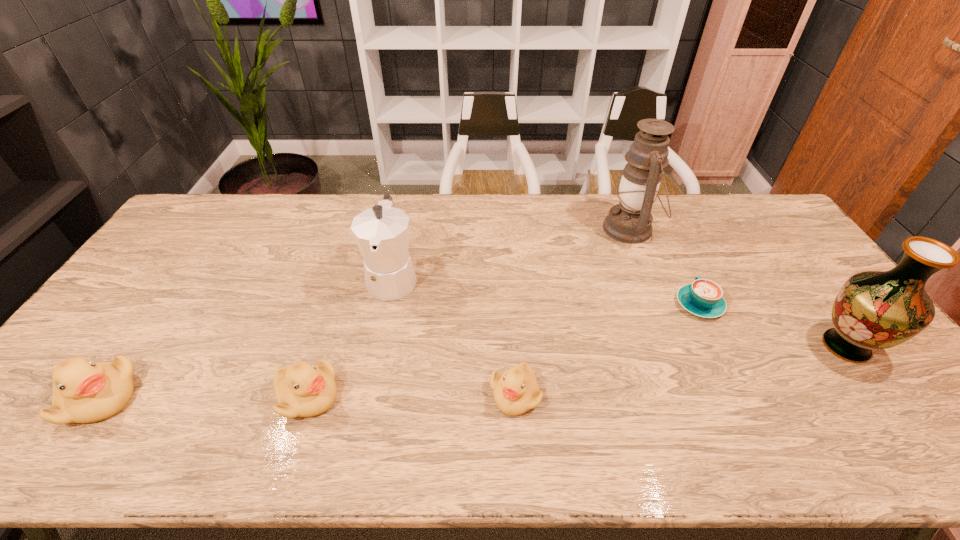
You are a GUI agent. You are given a task and a screenshot of the screen. Output one action in this format:
    pyautogui.click(x=<x>, y=<y>)
    Task: Click on the free point that satisfies the following two spatial constraints: 1. at the spout of the third tallest object; 2. on the right side of the rightmost object
    The height and width of the screenshot is (540, 960).
    Given the screenshot: What is the action you would take?
    pyautogui.click(x=378, y=347)

At what (x,y) coordinates should I click in order to perform the action: click on free region that satisfies the following two spatial constraints: 1. at the spout of the fifth shortest object; 2. on the front-facing side of the leftmost duckling. Please return your answer as a coordinate pair (x, y). The width and height of the screenshot is (960, 540). Looking at the image, I should click on (368, 399).

Find the location of `free space that satisfies the following two spatial constraints: 1. at the spout of the fifth shortest object; 2. on the front-facing side of the leftmost object`. free space that satisfies the following two spatial constraints: 1. at the spout of the fifth shortest object; 2. on the front-facing side of the leftmost object is located at coordinates pyautogui.click(x=368, y=399).